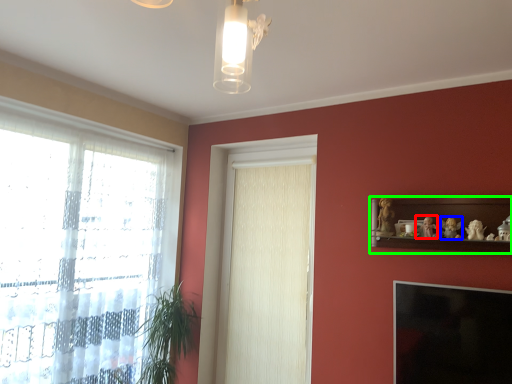
Question: Based on their relative distances, which object is farther from toy (highlighted by a red box)? Choose from toy (highlighted by a blue box) and shelf (highlighted by a green box).

Choices:
 (A) toy
 (B) shelf

Answer: (B)